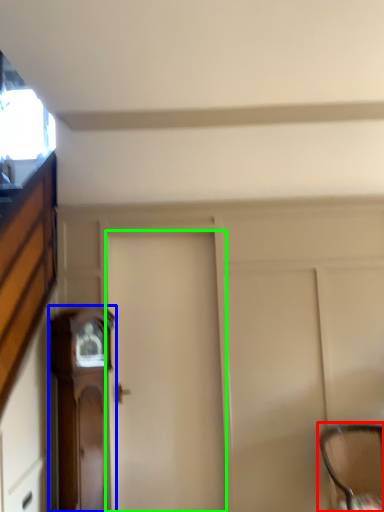
Question: Which is nearer to the chair (highlighted by a red box)? furniture (highlighted by a blue box) or door (highlighted by a green box).

Choices:
 (A) furniture
 (B) door

Answer: (B)